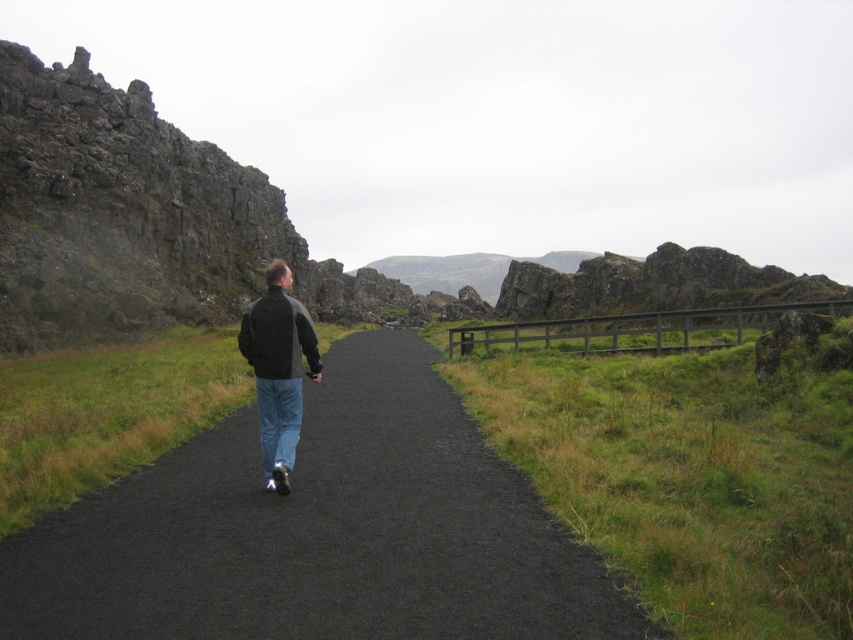
You are a hiker who wants to follow the path while keeping the rugged rock formation on your left. Which direction should you walk relative to the black asphalt trail at center and the blue denim jeans at center?

The black asphalt trail at center is larger than the blue denim jeans at center. To keep the rugged rock formation on your left, you should walk along the black asphalt trail at center to the right of the blue denim jeans at center.

You are standing at the starting point of the path and want to reach the end of the black asphalt trail at center. Which direction should you walk to stay on the trail?

You should walk forward along the black asphalt trail at center to reach its end since the trail is straight and centered in the scene.